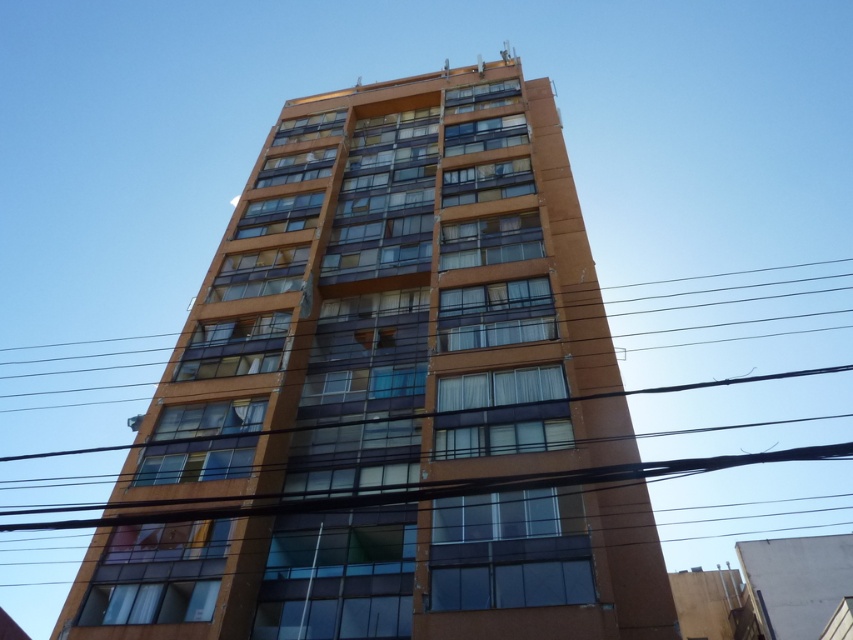
Between orange glass building at center and transparent glass power lines at center, which one appears on the right side from the viewer's perspective?

orange glass building at center is more to the right.

Is point (502, 244) closer to camera compared to point (35, 360)?

Yes.

Is point (543, 385) farther from viewer compared to point (144, 364)?

No.

Find the location of a particular element. orange glass building at center is located at coordinates (390, 396).